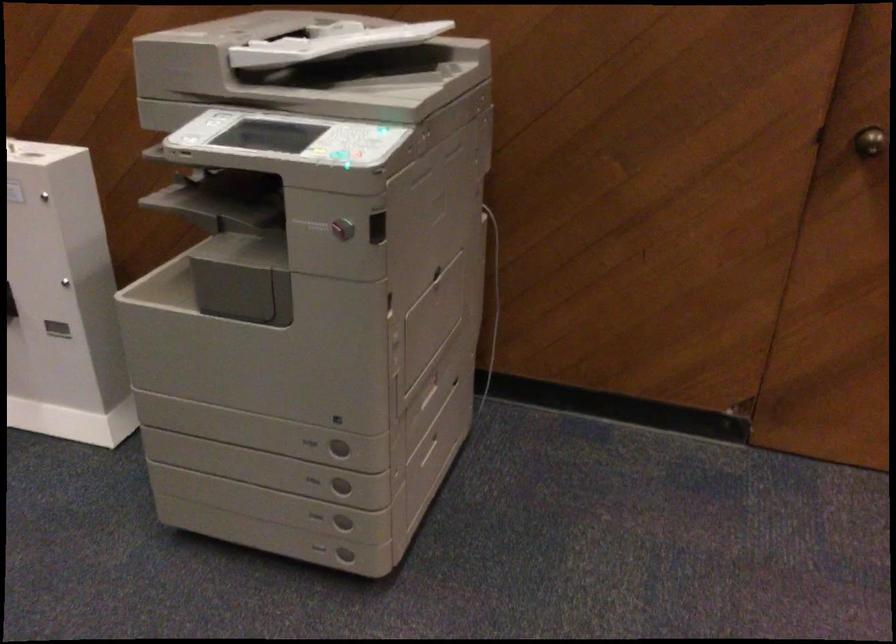
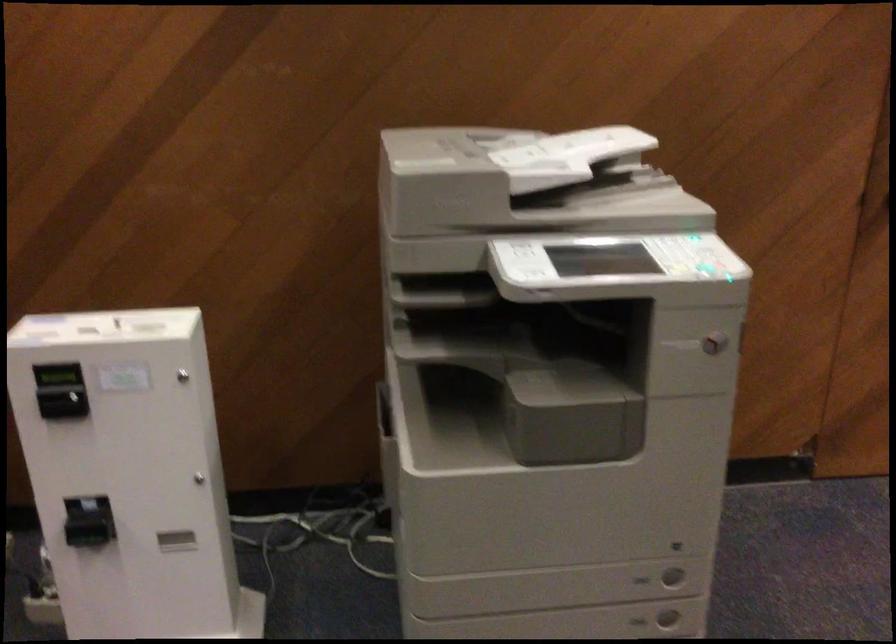
Locate, in the second image, the point that corresponds to the point at 319,453 in the first image.

(642, 580)